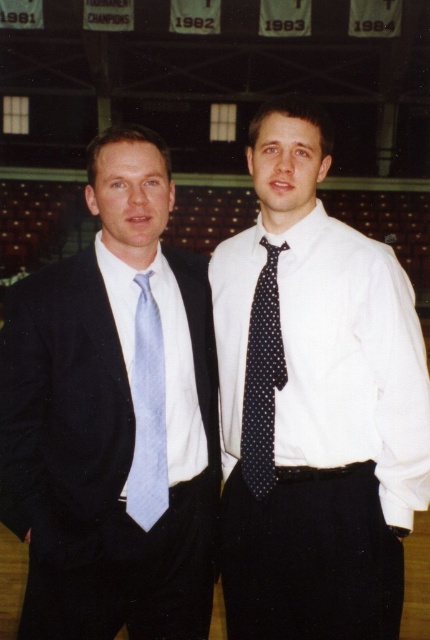
Question: Considering the real-world distances, which object is closest to the black dotted tie at center?

Choices:
 (A) white dotted tie at center
 (B) matte blue tie at left
 (C) light blue silk tie at left

Answer: (A)

Question: Can you confirm if light blue silk tie at left is positioned above black dotted tie at center?

Choices:
 (A) yes
 (B) no

Answer: (B)

Question: Which point is closer to the camera?

Choices:
 (A) light blue silk tie at left
 (B) white dotted tie at center

Answer: (A)

Question: Which of these objects is positioned farthest from the light blue silk tie at left?

Choices:
 (A) matte blue tie at left
 (B) white dotted tie at center
 (C) black dotted tie at center

Answer: (B)

Question: Does matte blue tie at left appear on the right side of black dotted tie at center?

Choices:
 (A) yes
 (B) no

Answer: (B)

Question: Does white dotted tie at center appear under light blue silk tie at left?

Choices:
 (A) yes
 (B) no

Answer: (B)